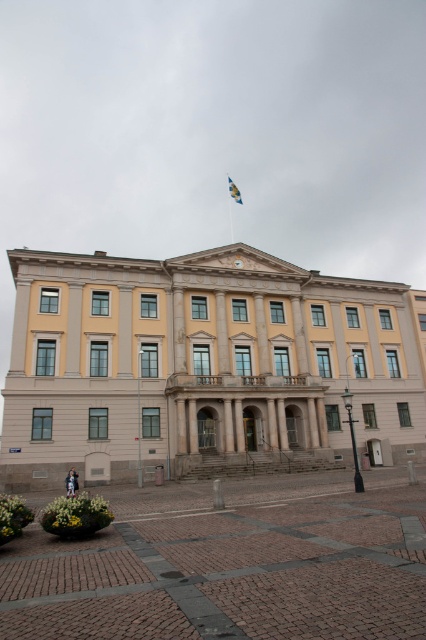
You are a visitor standing in front of the yellow stone building at center and the brick paving at center. Which one appears bigger in the image?

The yellow stone building at center has a larger size compared to the brick paving at center, so the yellow stone building at center appears bigger.

You are standing in front of the yellow stone building at center and want to hang a new flag higher than the existing blue fabric flag at upper center. Is this possible given their current heights?

The yellow stone building at center has a greater height compared to the blue fabric flag at upper center, so yes, it is possible to hang a new flag higher than the existing blue fabric flag at upper center by placing it on the building.

Based on the scene description, where is the yellow stone building at center located in terms of coordinates?

The yellow stone building at center is located at point coordinates of (203, 364).